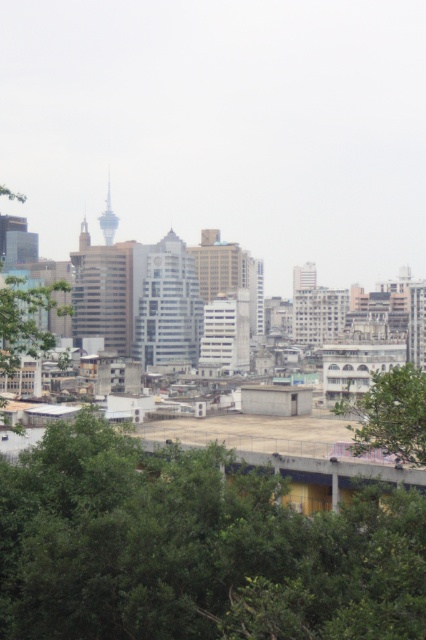
Question: In this image, where is green leafy tree at center located relative to green leafy tree at left?

Choices:
 (A) above
 (B) below

Answer: (B)

Question: From the image, what is the correct spatial relationship of green leafy tree at lower center in relation to green leafy tree at center?

Choices:
 (A) above
 (B) below

Answer: (B)

Question: Does green leafy tree at lower center appear on the right side of green leafy tree at center?

Choices:
 (A) yes
 (B) no

Answer: (B)

Question: Which point is closer to the camera taking this photo?

Choices:
 (A) (382, 380)
 (B) (187, 573)

Answer: (B)

Question: Which of the following is the closest to the observer?

Choices:
 (A) green leafy tree at lower center
 (B) green leafy tree at center
 (C) green leafy tree at left

Answer: (A)

Question: Which object is positioned closest to the green leafy tree at lower center?

Choices:
 (A) green leafy tree at left
 (B) green leafy tree at center

Answer: (B)